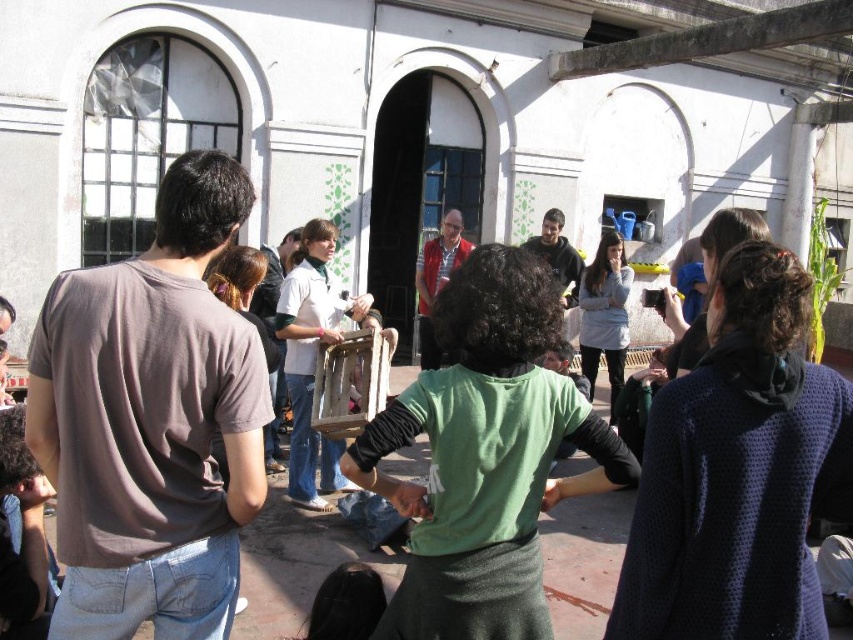
Does wooden frame at center have a lesser width compared to smooth green hand at center?

No, wooden frame at center is not thinner than smooth green hand at center.

Is point (338, 458) positioned behind point (560, 492)?

Yes, it is.

This screenshot has width=853, height=640. Describe the element at coordinates (312, 358) in the screenshot. I see `wooden frame at center` at that location.

The width and height of the screenshot is (853, 640). I want to click on wooden frame at center, so click(x=312, y=358).

From the picture: Which is more to the left, brown cotton t-shirt at left or white cotton shirt at center?

Positioned to the left is white cotton shirt at center.

This screenshot has width=853, height=640. Identify the location of brown cotton t-shirt at left. (151, 420).

You are a GUI agent. You are given a task and a screenshot of the screen. Output one action in this format:
    pyautogui.click(x=<x>, y=<y>)
    Task: Click on the brown cotton t-shirt at left
    
    Given the screenshot: What is the action you would take?
    pyautogui.click(x=151, y=420)

Is wooden frame at center closer to the viewer compared to dark gray hoodie at center?

Yes, it is.

In the scene shown: Who is lower down, wooden frame at center or dark gray hoodie at center?

wooden frame at center is lower down.

At what (x,y) coordinates should I click in order to perform the action: click on wooden frame at center. Please return your answer as a coordinate pair (x, y). Looking at the image, I should click on click(x=312, y=358).

Identify the location of wooden frame at center. This screenshot has width=853, height=640. (312, 358).